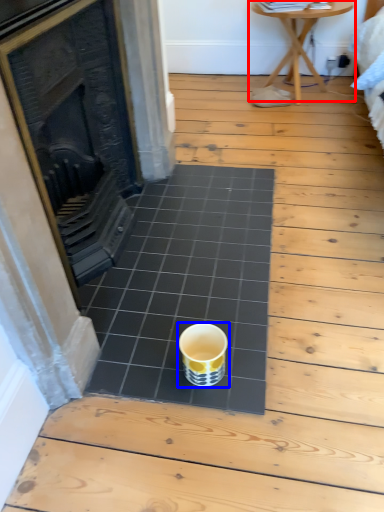
Question: Which of the following is the farthest to the observer, table (highlighted by a red box) or coffee cup (highlighted by a blue box)?

Choices:
 (A) table
 (B) coffee cup

Answer: (A)